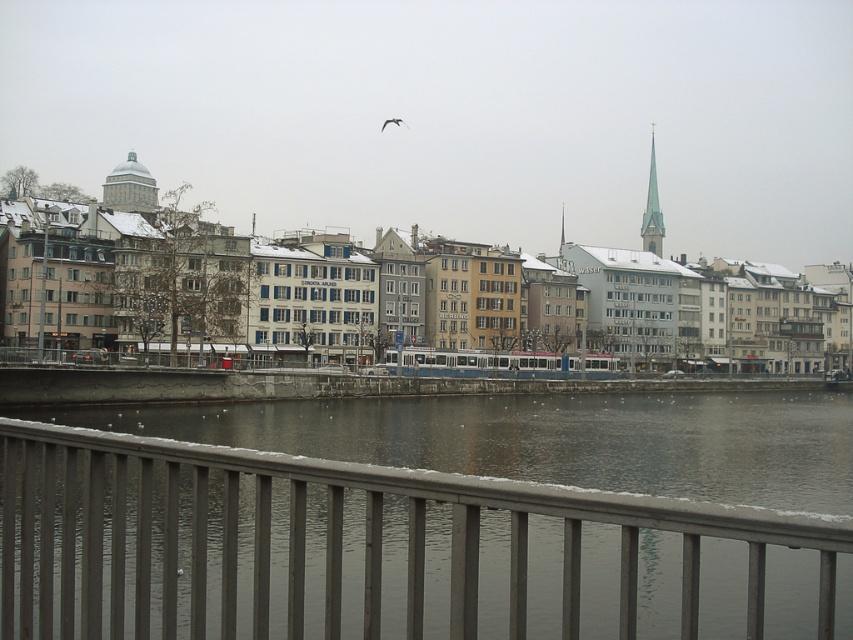
You are standing at the point marked as point (312, 483) in the image. If you want to walk towards the river, which direction should you head?

Since the point is located in the midground near the buildings, you should head forward towards the river which is in the foreground beyond the railing.

Consider the image. You are standing at a viewpoint overlooking the urban riverside scene. There are two points marked in the image. The first point is located at coordinates point (157, 531) and the second point is at point (653, 230). Which of these two points is nearer to your current position?

Point (157, 531) is closer to the camera than point (653, 230), so the first point is nearer to your current position.